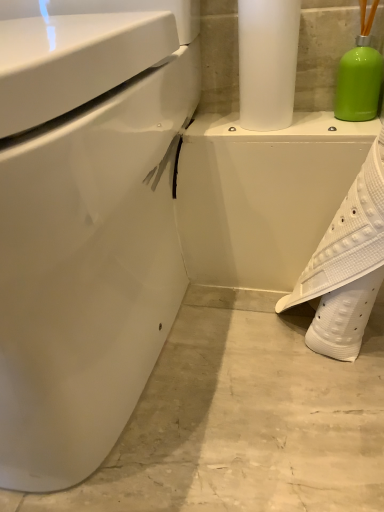
Question: Is the depth of white textured shoe at lower right greater than that of white glossy toilet at left?

Choices:
 (A) yes
 (B) no

Answer: (A)

Question: From the image's perspective, is white textured shoe at lower right over white glossy toilet at left?

Choices:
 (A) no
 (B) yes

Answer: (A)

Question: Is white textured shoe at lower right looking in the opposite direction of white glossy toilet at left?

Choices:
 (A) no
 (B) yes

Answer: (A)

Question: From a real-world perspective, is white textured shoe at lower right on white glossy toilet at left?

Choices:
 (A) yes
 (B) no

Answer: (B)

Question: Considering the relative sizes of white textured shoe at lower right and white glossy toilet at left in the image provided, is white textured shoe at lower right thinner than white glossy toilet at left?

Choices:
 (A) no
 (B) yes

Answer: (B)

Question: Is white textured shoe at lower right located outside white glossy toilet at left?

Choices:
 (A) no
 (B) yes

Answer: (B)

Question: Considering the relative positions of white glossy porcelain at center and white glossy toilet at left in the image provided, is white glossy porcelain at center in front of white glossy toilet at left?

Choices:
 (A) yes
 (B) no

Answer: (B)

Question: Can you confirm if white glossy porcelain at center is smaller than white glossy toilet at left?

Choices:
 (A) yes
 (B) no

Answer: (A)

Question: Considering the relative sizes of white glossy porcelain at center and white glossy toilet at left in the image provided, is white glossy porcelain at center shorter than white glossy toilet at left?

Choices:
 (A) no
 (B) yes

Answer: (B)

Question: Is white glossy porcelain at center beside white glossy toilet at left?

Choices:
 (A) no
 (B) yes

Answer: (A)

Question: From a real-world perspective, is white glossy porcelain at center physically above white glossy toilet at left?

Choices:
 (A) yes
 (B) no

Answer: (B)

Question: From a real-world perspective, is white glossy porcelain at center below white glossy toilet at left?

Choices:
 (A) yes
 (B) no

Answer: (A)

Question: Is satin white paper towel at upper center located outside white textured shoe at lower right?

Choices:
 (A) no
 (B) yes

Answer: (B)